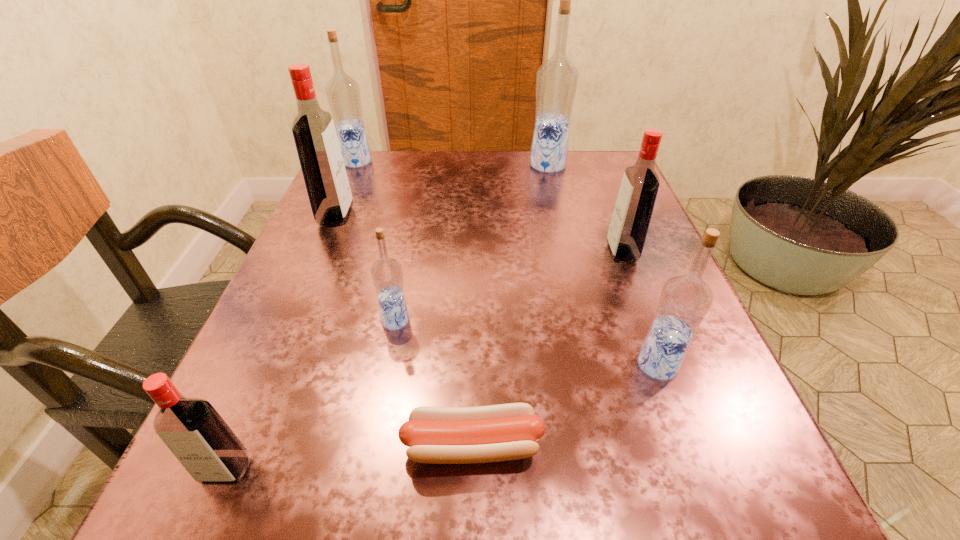
Locate an element on the screen. the smallest red vodka is located at coordinates (192, 429).

Where is `the smallest blue vodka`? The width and height of the screenshot is (960, 540). the smallest blue vodka is located at coordinates (387, 276).

Find the location of a particular element. the fourth nearest object is located at coordinates (387, 276).

The height and width of the screenshot is (540, 960). What are the coordinates of `the fifth object from left to right` in the screenshot? It's located at (437, 435).

Identify the location of brown sausage. Image resolution: width=960 pixels, height=540 pixels. 437,435.

At what (x,y) coordinates should I click in order to perform the action: click on free space located 0.130m on the right of the tallest object. Please return your answer as a coordinate pair (x, y). The height and width of the screenshot is (540, 960). Looking at the image, I should click on (618, 165).

At what (x,y) coordinates should I click in order to perform the action: click on vacant space situated on the front of the third smallest blue vodka. Please return your answer as a coordinate pair (x, y). Image resolution: width=960 pixels, height=540 pixels. Looking at the image, I should click on [x=334, y=215].

Where is `free space located 0.200m on the front and back of the fifth nearest vodka`? free space located 0.200m on the front and back of the fifth nearest vodka is located at coordinates (446, 216).

I want to click on vacant space located on the front and back of the second nearest red vodka, so click(x=434, y=253).

Locate an element on the screen. The width and height of the screenshot is (960, 540). free location located on the front and back of the second nearest red vodka is located at coordinates (434, 253).